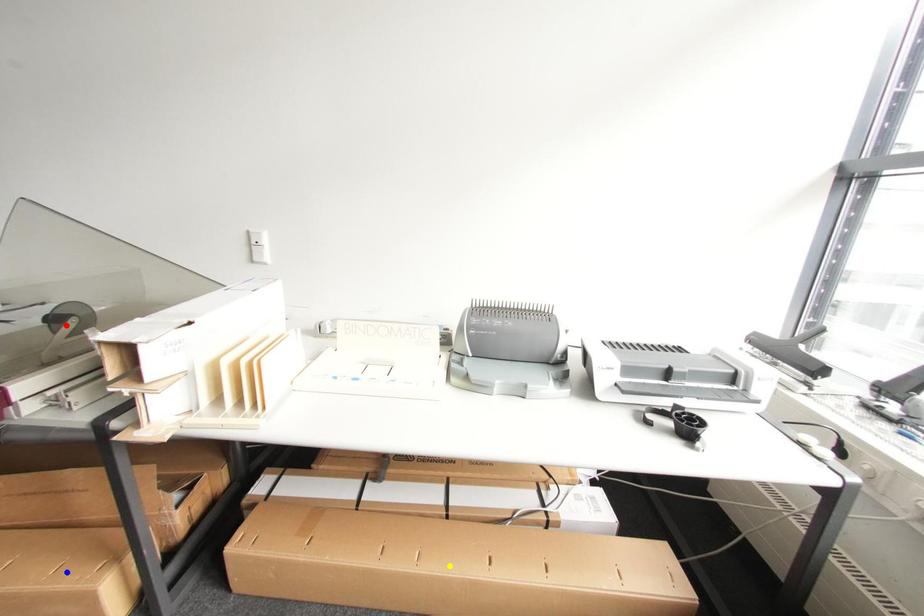
Order these from nearest to farthest:
1. blue point
2. red point
3. yellow point

blue point → yellow point → red point